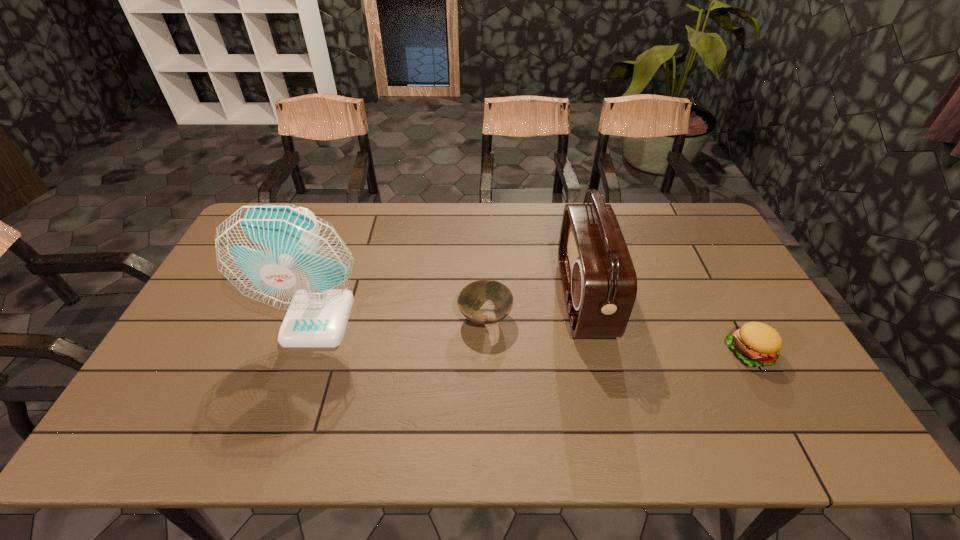
The width and height of the screenshot is (960, 540). I want to click on the tallest object, so click(x=284, y=256).

Find the location of a particular element. This screenshot has height=540, width=960. fan is located at coordinates (284, 256).

This screenshot has width=960, height=540. I want to click on the second tallest object, so click(x=599, y=281).

This screenshot has height=540, width=960. I want to click on the second object from right to left, so click(599, 281).

At what (x,y) coordinates should I click in order to perform the action: click on hamburger. Please return your answer as a coordinate pair (x, y). The height and width of the screenshot is (540, 960). Looking at the image, I should click on (756, 343).

You are a GUI agent. You are given a task and a screenshot of the screen. Output one action in this format:
    pyautogui.click(x=<x>, y=<y>)
    Task: Click on the third object from right to left
    This screenshot has height=540, width=960.
    Given the screenshot: What is the action you would take?
    pyautogui.click(x=472, y=297)

I want to click on free space located in front of the tallest object to face the airflow, so click(x=294, y=391).

Where is `free point located 0.120m on the front panel of the third object from left to right`? The width and height of the screenshot is (960, 540). free point located 0.120m on the front panel of the third object from left to right is located at coordinates (523, 298).

You are a GUI agent. You are given a task and a screenshot of the screen. Output one action in this format:
    pyautogui.click(x=<x>, y=<y>)
    Task: Click on the blank space located 0.280m on the front panel of the third object from left to right
    Image resolution: width=960 pixels, height=540 pixels.
    Given the screenshot: What is the action you would take?
    pyautogui.click(x=469, y=298)

Locate an element on the screen. The width and height of the screenshot is (960, 540). vacant space located 0.080m on the front panel of the third object from left to right is located at coordinates (537, 298).